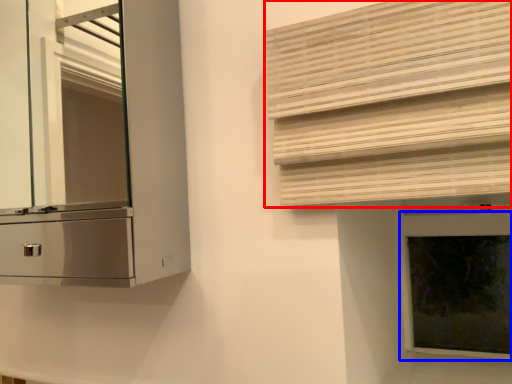
Question: Which object is further to the camera taking this photo, shutter (highlighted by a red box) or window frame (highlighted by a blue box)?

Choices:
 (A) shutter
 (B) window frame

Answer: (B)